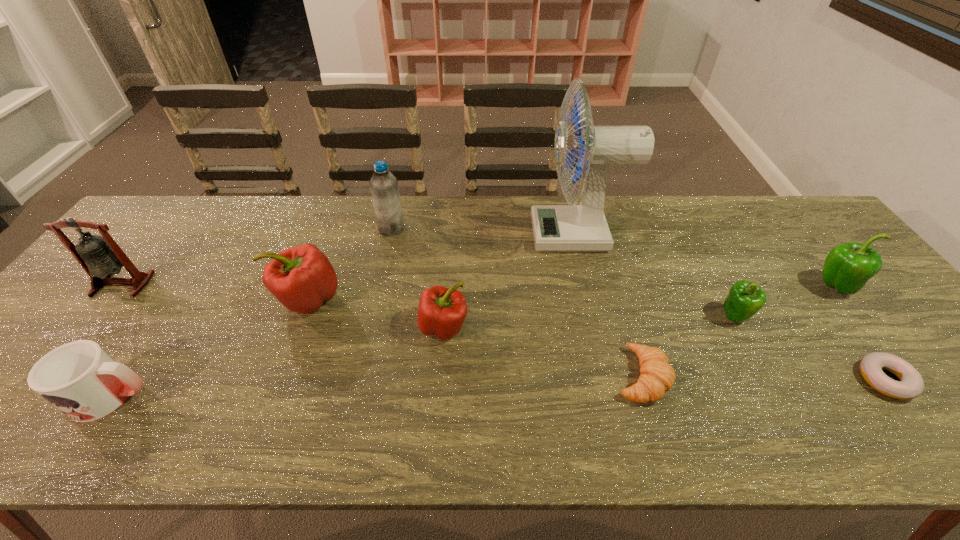
This screenshot has width=960, height=540. Find the location of `vacant point located between the sixth object from right to left and the nearer green bell pepper`. vacant point located between the sixth object from right to left and the nearer green bell pepper is located at coordinates (589, 321).

At what (x,y) coordinates should I click in order to perform the action: click on free space between the mug and the ninth tallest object. Please return your answer as a coordinate pair (x, y). This screenshot has height=540, width=960. Looking at the image, I should click on (376, 386).

Locate an element on the screen. The image size is (960, 540). vacant space in between the leftmost object and the tallest object is located at coordinates (349, 259).

Locate an element on the screen. The height and width of the screenshot is (540, 960). vacant region between the rightmost bell pepper and the third object from right to left is located at coordinates (785, 301).

Where is `free space between the seventh object from right to left and the eighth object from left to right`? free space between the seventh object from right to left and the eighth object from left to right is located at coordinates (564, 272).

Identify the location of unoccupied position between the blue water bottle and the ninth object from right to left. (252, 313).

I want to click on free spot between the water bottle and the mug, so click(x=252, y=313).

Locate which object ranks eighth in proximity to the farther green bell pepper. Please provide its 2D coordinates. Your answer should be formatted as a tuple, i.e. [(x, y)], where the tuple contains the x and y coordinates of a point satisfying the conditions above.

[(79, 378)]

Identify which object is the fifth nearest to the second shortest object. Please provide its 2D coordinates. Your answer should be formatted as a tuple, i.e. [(x, y)], where the tuple contains the x and y coordinates of a point satisfying the conditions above.

[(848, 267)]

Locate an element on the screen. The image size is (960, 540). the third closest bell pepper to the sixth object from right to left is located at coordinates (848, 267).